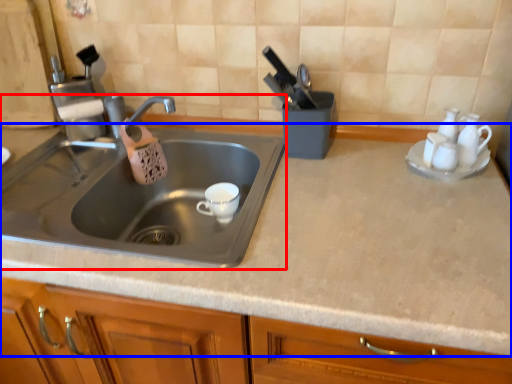
Question: Which point is closer to the camera, sink (highlighted by a red box) or countertop (highlighted by a blue box)?

Choices:
 (A) sink
 (B) countertop

Answer: (B)